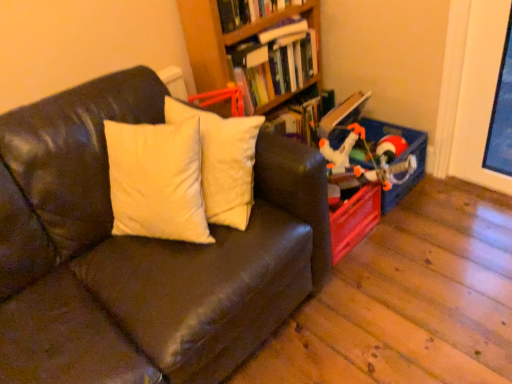
Measure the distance between point (285, 94) and camera.

Point (285, 94) and camera are 7.19 feet apart.

Identify the location of leather couch at left. Image resolution: width=512 pixels, height=384 pixels. (140, 252).

Locate an element on the screen. The width and height of the screenshot is (512, 384). matte plastic toy at right is located at coordinates (368, 159).

The image size is (512, 384). What do you see at coordinates (368, 159) in the screenshot?
I see `matte plastic toy at right` at bounding box center [368, 159].

Where is `hardcover book at upper center, positioned as the first book in bottom-to-top order`? hardcover book at upper center, positioned as the first book in bottom-to-top order is located at coordinates (275, 62).

From the image's perspective, is matte plastic toy at right located above hardcover book at upper center, the first book when ordered from top to bottom?

No, from the image's perspective, matte plastic toy at right is not above hardcover book at upper center, the first book when ordered from top to bottom.

Would you say matte plastic toy at right is a long distance from hardcover book at upper center, the 2th book positioned from the bottom?

No, matte plastic toy at right is in close proximity to hardcover book at upper center, the 2th book positioned from the bottom.

I want to click on toy beneath the hardcover book at upper center, the first book when ordered from top to bottom (from a real-world perspective), so click(368, 159).

From a real-world perspective, between matte plastic toy at right and hardcover book at upper center, the 2th book positioned from the bottom, who is vertically lower?

matte plastic toy at right, from a real-world perspective.

From the image's perspective, which one is positioned lower, leather couch at left or hardcover book at upper center, the 2th book positioned from the bottom?

leather couch at left is shown below in the image.

From a real-world perspective, who is located higher, leather couch at left or hardcover book at upper center, the first book when ordered from top to bottom?

In real-world perspective, hardcover book at upper center, the first book when ordered from top to bottom, is above.

Considering the positions of point (279, 304) and point (236, 0), is point (279, 304) closer or farther from the camera than point (236, 0)?

Point (279, 304) appears to be closer to the viewer than point (236, 0).

Is leather couch at left not close to hardcover book at upper center, the first book when ordered from top to bottom?

They are positioned close to each other.

Does hardcover book at upper center, the first book when ordered from top to bottom, contain matte plastic toy at right?

That's incorrect, matte plastic toy at right is not inside hardcover book at upper center, the first book when ordered from top to bottom.

Is matte plastic toy at right at the back of hardcover book at upper center, the first book when ordered from top to bottom?

No, hardcover book at upper center, the first book when ordered from top to bottom, is not facing away from matte plastic toy at right.

Can you confirm if hardcover book at upper center, the 2th book positioned from the bottom, is positioned to the left of matte plastic toy at right?

Yes, hardcover book at upper center, the 2th book positioned from the bottom, is to the left of matte plastic toy at right.

Considering the sizes of objects hardcover book at upper center, the 2th book positioned from the bottom, and matte plastic toy at right in the image provided, who is taller, hardcover book at upper center, the 2th book positioned from the bottom, or matte plastic toy at right?

matte plastic toy at right is taller.

Considering the sizes of wooden bookshelf at upper center and hardcover book at upper center, the first book when ordered from top to bottom, in the image, is wooden bookshelf at upper center bigger or smaller than hardcover book at upper center, the first book when ordered from top to bottom,?

Clearly, wooden bookshelf at upper center is larger in size than hardcover book at upper center, the first book when ordered from top to bottom.

How different are the orientations of wooden bookshelf at upper center and hardcover book at upper center, the first book when ordered from top to bottom, in degrees?

0.35 degrees separate the facing orientations of wooden bookshelf at upper center and hardcover book at upper center, the first book when ordered from top to bottom.

Is wooden bookshelf at upper center thinner than hardcover book at upper center, the first book when ordered from top to bottom?

Correct, the width of wooden bookshelf at upper center is less than that of hardcover book at upper center, the first book when ordered from top to bottom.

Does point (51, 137) come closer to viewer compared to point (261, 36)?

That is True.

Is leather couch at left oriented towards hardcover book at upper center, the second book from the top?

No, leather couch at left does not turn towards hardcover book at upper center, the second book from the top.

I want to click on studio couch that is below the hardcover book at upper center, positioned as the first book in bottom-to-top order (from the image's perspective), so click(x=140, y=252).

Can you confirm if leather couch at left is thinner than hardcover book at upper center, the second book from the top?

Incorrect, the width of leather couch at left is not less than that of hardcover book at upper center, the second book from the top.

Between hardcover book at upper center, positioned as the first book in bottom-to-top order, and wooden bookshelf at upper center, which one appears on the right side from the viewer's perspective?

hardcover book at upper center, positioned as the first book in bottom-to-top order.

Which point is more forward, (245,73) or (188,37)?

The point (188,37) is closer to the camera.

From a real-world perspective, is hardcover book at upper center, positioned as the first book in bottom-to-top order, located beneath wooden bookshelf at upper center?

No, from a real-world perspective, hardcover book at upper center, positioned as the first book in bottom-to-top order, is not below wooden bookshelf at upper center.

How different are the orientations of hardcover book at upper center, the second book from the top, and wooden bookshelf at upper center in degrees?

0.228 degrees separate the facing orientations of hardcover book at upper center, the second book from the top, and wooden bookshelf at upper center.

In the scene shown: From the image's perspective, is wooden bookshelf at upper center positioned above or below leather couch at left?

Based on their image positions, wooden bookshelf at upper center is located above leather couch at left.

Which object is further away from the camera taking this photo, wooden bookshelf at upper center or leather couch at left?

wooden bookshelf at upper center is more distant.

Based on their sizes in the image, would you say wooden bookshelf at upper center is bigger or smaller than leather couch at left?

Clearly, wooden bookshelf at upper center is smaller in size than leather couch at left.

In the scene shown: Visually, is wooden bookshelf at upper center positioned to the left or to the right of leather couch at left?

wooden bookshelf at upper center is to the right of leather couch at left.

You are a GUI agent. You are given a task and a screenshot of the screen. Output one action in this format:
    pyautogui.click(x=<x>, y=<y>)
    Task: Click on the book that is the 2nd object to the left of the matte plastic toy at right, starting at the anchor
    Image resolution: width=512 pixels, height=384 pixels.
    Given the screenshot: What is the action you would take?
    pyautogui.click(x=249, y=11)

In the image, there is a hardcover book at upper center, the first book when ordered from top to bottom. Find the location of `studio couch below it (from the image's perspective)`. studio couch below it (from the image's perspective) is located at coordinates (140, 252).

When comparing their distances from hardcover book at upper center, positioned as the first book in bottom-to-top order, does hardcover book at upper center, the first book when ordered from top to bottom, or wooden bookshelf at upper center seem closer?

Among the two, wooden bookshelf at upper center is located nearer to hardcover book at upper center, positioned as the first book in bottom-to-top order.

Looking at the image, which one is located further to matte plastic toy at right, hardcover book at upper center, the 2th book positioned from the bottom, or hardcover book at upper center, positioned as the first book in bottom-to-top order?

Among the two, hardcover book at upper center, the 2th book positioned from the bottom, is located further to matte plastic toy at right.

Which object lies nearer to the anchor point matte plastic toy at right, wooden bookshelf at upper center or hardcover book at upper center, the 2th book positioned from the bottom?

wooden bookshelf at upper center.

Looking at the image, which one is located further to wooden bookshelf at upper center, matte plastic toy at right or hardcover book at upper center, the second book from the top?

Based on the image, matte plastic toy at right appears to be further to wooden bookshelf at upper center.

When comparing their distances from leather couch at left, does wooden bookshelf at upper center or hardcover book at upper center, the first book when ordered from top to bottom, seem closer?

Among the two, wooden bookshelf at upper center is located nearer to leather couch at left.

Consider the image. Considering their positions, is hardcover book at upper center, positioned as the first book in bottom-to-top order, positioned further to leather couch at left than matte plastic toy at right?

Based on the image, hardcover book at upper center, positioned as the first book in bottom-to-top order, appears to be further to leather couch at left.

From the image, which object appears to be nearer to leather couch at left, wooden bookshelf at upper center or matte plastic toy at right?

wooden bookshelf at upper center is closer to leather couch at left.

Based on their spatial positions, is wooden bookshelf at upper center or hardcover book at upper center, the 2th book positioned from the bottom, closer to hardcover book at upper center, positioned as the first book in bottom-to-top order?

wooden bookshelf at upper center is closer to hardcover book at upper center, positioned as the first book in bottom-to-top order.

Locate an element on the screen. bookcase between hardcover book at upper center, the first book when ordered from top to bottom, and matte plastic toy at right in the up-down direction is located at coordinates (224, 37).

Locate an element on the screen. The height and width of the screenshot is (384, 512). book that lies between hardcover book at upper center, the 2th book positioned from the bottom, and wooden bookshelf at upper center from top to bottom is located at coordinates (275, 62).

I want to click on bookcase between leather couch at left and matte plastic toy at right from front to back, so click(224, 37).

Identify the location of book located between wooden bookshelf at upper center and matte plastic toy at right in the left-right direction. (275, 62).